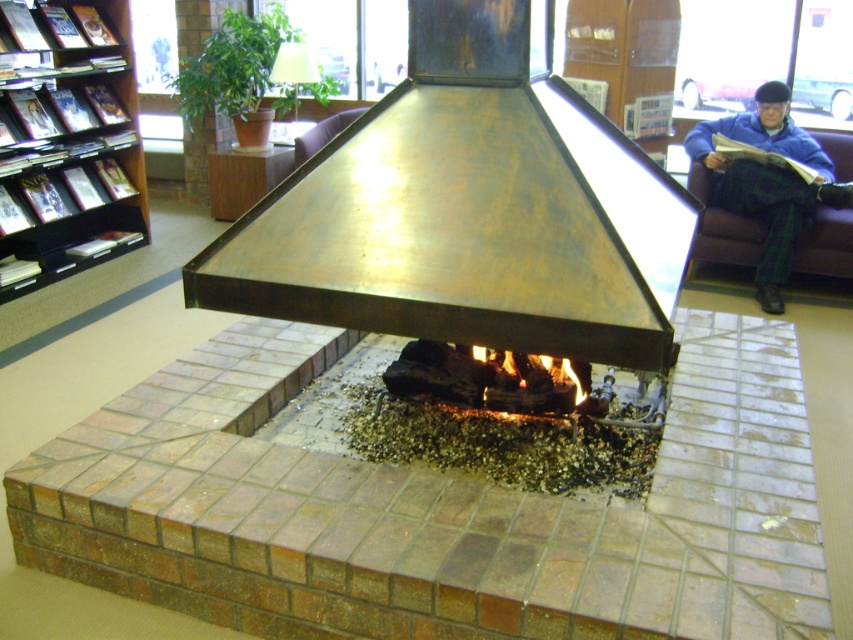
Who is taller, blue plaid pants at upper right or charcoal wood fire at center?

Standing taller between the two is blue plaid pants at upper right.

Describe the element at coordinates (764, 180) in the screenshot. I see `blue plaid pants at upper right` at that location.

This screenshot has width=853, height=640. I want to click on blue plaid pants at upper right, so click(764, 180).

Who is positioned more to the right, shiny brass fireplace at center or charcoal wood fire at center?

Positioned to the right is shiny brass fireplace at center.

Can you confirm if shiny brass fireplace at center is thinner than charcoal wood fire at center?

Incorrect, shiny brass fireplace at center's width is not less than charcoal wood fire at center's.

Who is more forward, (509, 186) or (396, 394)?

Point (509, 186) is more forward.

The height and width of the screenshot is (640, 853). I want to click on shiny brass fireplace at center, so point(468,212).

This screenshot has height=640, width=853. Describe the element at coordinates (68, 141) in the screenshot. I see `black wood bookshelf at left` at that location.

Looking at this image, who is positioned more to the right, black wood bookshelf at left or blue plaid pants at upper right?

Positioned to the right is blue plaid pants at upper right.

Find the location of a particular element. This screenshot has width=853, height=640. black wood bookshelf at left is located at coordinates (68, 141).